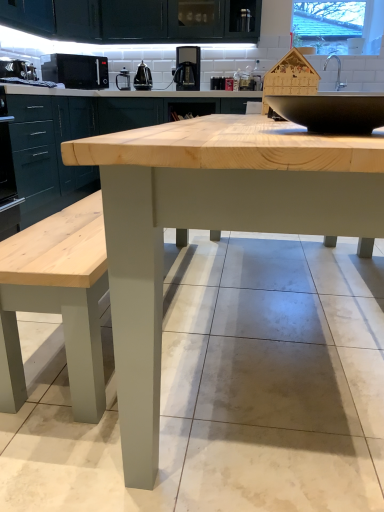
Question: Which direction should I rotate to look at satin black kettle at upper center, the third appliance positioned from the front, — up or down?

Choices:
 (A) up
 (B) down

Answer: (A)

Question: Is natural wood table at center looking in the opposite direction of satin black kettle at upper center, the second appliance when ordered from back to front?

Choices:
 (A) no
 (B) yes

Answer: (A)

Question: Is natural wood table at center positioned beyond the bounds of satin black kettle at upper center, which is the 1th appliance in right-to-left order?

Choices:
 (A) yes
 (B) no

Answer: (A)

Question: Is natural wood table at center touching satin black kettle at upper center, the fourth appliance from the left?

Choices:
 (A) no
 (B) yes

Answer: (A)

Question: From a real-world perspective, is natural wood table at center located beneath satin black kettle at upper center, the third appliance positioned from the front?

Choices:
 (A) yes
 (B) no

Answer: (A)

Question: Is natural wood table at center positioned behind satin black kettle at upper center, which is the 1th appliance in right-to-left order?

Choices:
 (A) yes
 (B) no

Answer: (B)

Question: Considering the relative sizes of natural wood table at center and satin black kettle at upper center, the second appliance when ordered from back to front, in the image provided, is natural wood table at center wider than satin black kettle at upper center, the second appliance when ordered from back to front,?

Choices:
 (A) yes
 (B) no

Answer: (A)

Question: Is satin black coffee machine at upper center positioned in front of natural wood table at center?

Choices:
 (A) yes
 (B) no

Answer: (B)

Question: Does satin black coffee machine at upper center appear on the left side of natural wood table at center?

Choices:
 (A) no
 (B) yes

Answer: (B)

Question: Can you confirm if satin black coffee machine at upper center is shorter than natural wood table at center?

Choices:
 (A) yes
 (B) no

Answer: (A)

Question: Is satin black coffee machine at upper center positioned behind natural wood table at center?

Choices:
 (A) no
 (B) yes

Answer: (B)

Question: Is natural wood table at center inside satin black coffee machine at upper center?

Choices:
 (A) no
 (B) yes

Answer: (A)

Question: From the image's perspective, would you say satin black coffee machine at upper center is shown under natural wood table at center?

Choices:
 (A) no
 (B) yes

Answer: (A)

Question: Is natural wood table at center closer to camera compared to black matte microwave at upper left, the third appliance in the back-to-front sequence?

Choices:
 (A) yes
 (B) no

Answer: (A)